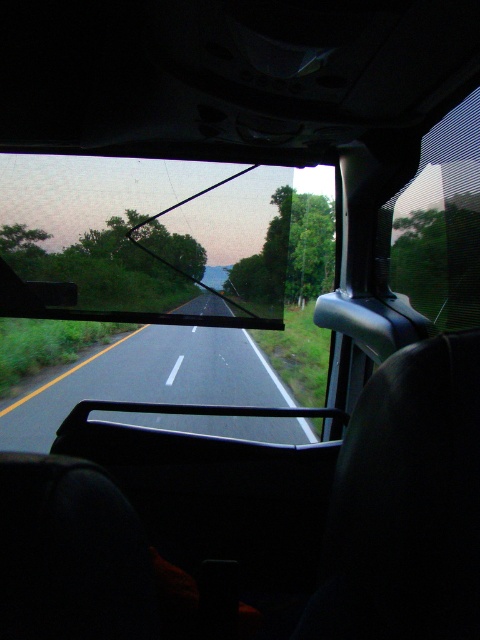
Question: Which point is farther to the camera?

Choices:
 (A) (422, 268)
 (B) (180, 221)

Answer: (B)

Question: Which object appears closest to the camera in this image?

Choices:
 (A) transparent glass windshield at center
 (B) transparent mesh car window at right

Answer: (B)

Question: Is transparent glass windshield at center to the left of transparent mesh car window at right from the viewer's perspective?

Choices:
 (A) no
 (B) yes

Answer: (B)

Question: Is transparent glass windshield at center closer to camera compared to transparent mesh car window at right?

Choices:
 (A) no
 (B) yes

Answer: (A)

Question: Is transparent glass windshield at center to the right of transparent mesh car window at right from the viewer's perspective?

Choices:
 (A) no
 (B) yes

Answer: (A)

Question: Which object is closer to the camera taking this photo?

Choices:
 (A) transparent mesh car window at right
 (B) transparent glass windshield at center

Answer: (A)